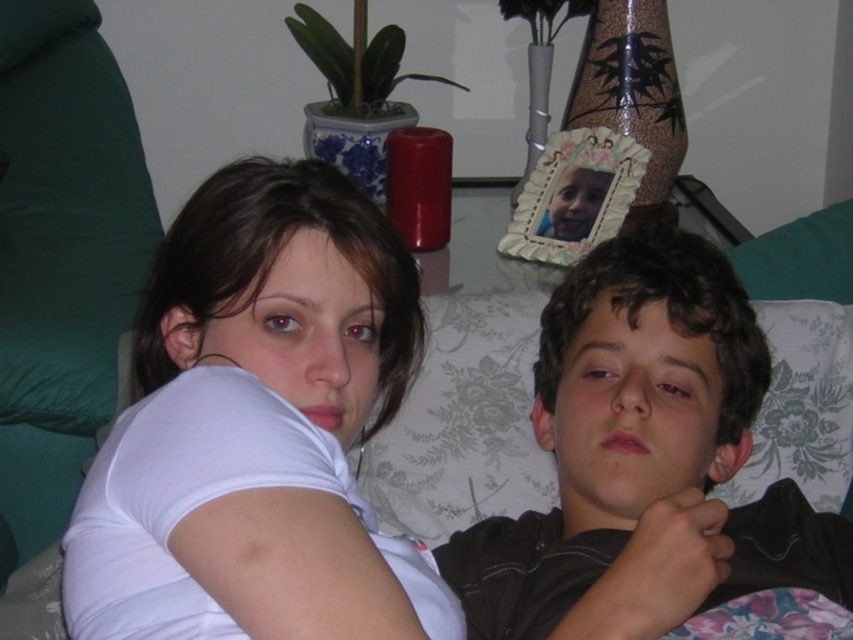
Question: Which of the following is the closest to the observer?

Choices:
 (A) (689, 323)
 (B) (270, 394)

Answer: (B)

Question: Among these objects, which one is nearest to the camera?

Choices:
 (A) dark brown curly hair at center
 (B) white matte shirt at upper left

Answer: (B)

Question: Is white matte shirt at upper left thinner than dark brown curly hair at center?

Choices:
 (A) yes
 (B) no

Answer: (A)

Question: Is white matte shirt at upper left to the right of dark brown curly hair at center from the viewer's perspective?

Choices:
 (A) yes
 (B) no

Answer: (B)

Question: Is white matte shirt at upper left positioned behind dark brown curly hair at center?

Choices:
 (A) no
 (B) yes

Answer: (A)